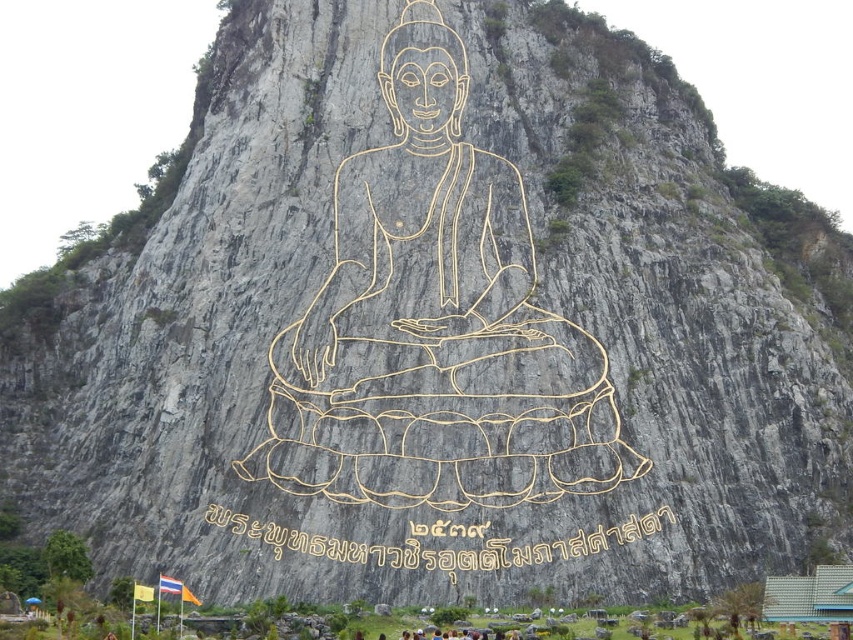
Question: From the image, what is the correct spatial relationship of gold wire buddha at center in relation to yellow gold text at center?

Choices:
 (A) below
 (B) above

Answer: (B)

Question: Does gold wire buddha at center have a smaller size compared to yellow gold text at center?

Choices:
 (A) no
 (B) yes

Answer: (A)

Question: Is gold wire buddha at center above yellow gold text at center?

Choices:
 (A) yes
 (B) no

Answer: (A)

Question: Which point appears closest to the camera in this image?

Choices:
 (A) (344, 378)
 (B) (392, 564)

Answer: (B)

Question: Among these objects, which one is farthest from the camera?

Choices:
 (A) gold wire buddha at center
 (B) yellow gold text at center

Answer: (A)